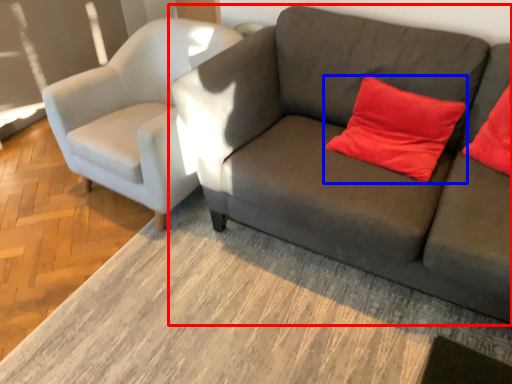
Question: Which object appears closest to the camera in this image, studio couch (highlighted by a red box) or pillow (highlighted by a blue box)?

Choices:
 (A) studio couch
 (B) pillow

Answer: (A)